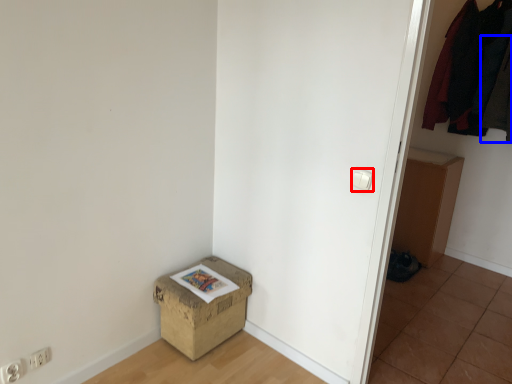
Question: Which point is closer to the camera, light switch (highlighted by a red box) or clothing (highlighted by a blue box)?

Choices:
 (A) light switch
 (B) clothing

Answer: (A)